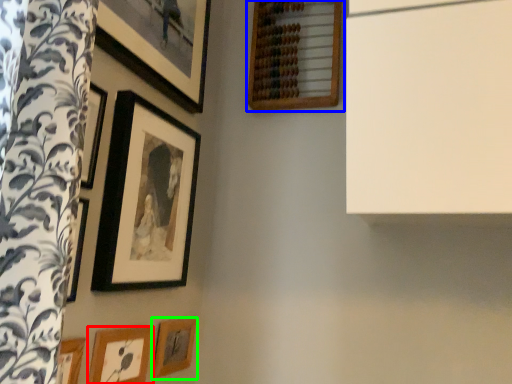
Question: Which is farther away from picture frame (highlighted by a red box)? picture frame (highlighted by a blue box) or picture frame (highlighted by a green box)?

Choices:
 (A) picture frame
 (B) picture frame

Answer: (A)